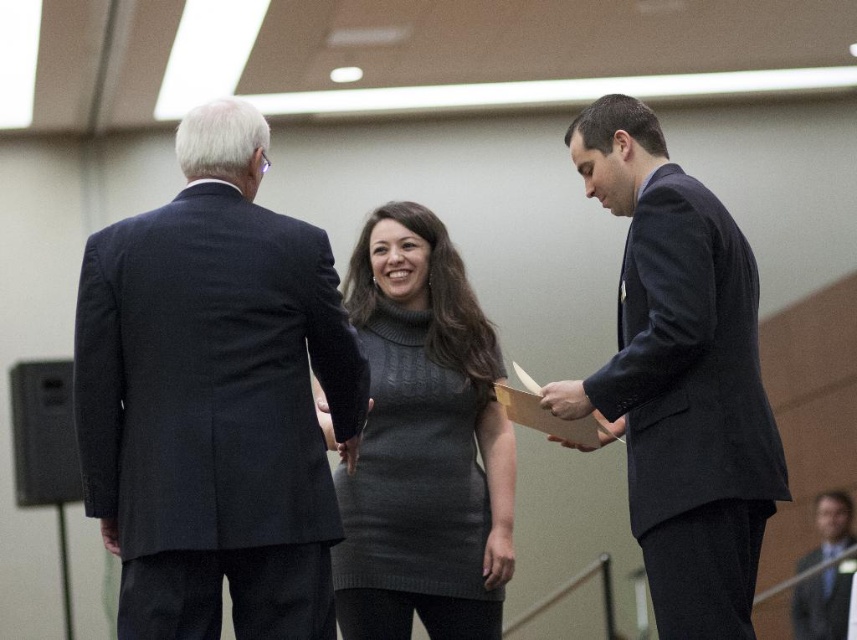
Question: Does dark blue suit at right appear over gray knitted dress at center?

Choices:
 (A) yes
 (B) no

Answer: (A)

Question: Can you confirm if dark blue suit at right is thinner than gray knitted dress at center?

Choices:
 (A) no
 (B) yes

Answer: (A)

Question: Which point appears farthest from the camera in this image?

Choices:
 (A) (109, 440)
 (B) (493, 452)
 (C) (800, 596)

Answer: (C)

Question: Estimate the real-world distances between objects in this image. Which object is farther from the dark blue suit at center?

Choices:
 (A) dark blue suit at right
 (B) gray knitted dress at center

Answer: (A)

Question: Which point appears farthest from the camera in this image?

Choices:
 (A) (412, 225)
 (B) (712, 314)
 (C) (814, 499)
 (D) (306, 628)

Answer: (C)

Question: Is dark blue suit at left in front of dark blue suit at center?

Choices:
 (A) no
 (B) yes

Answer: (B)